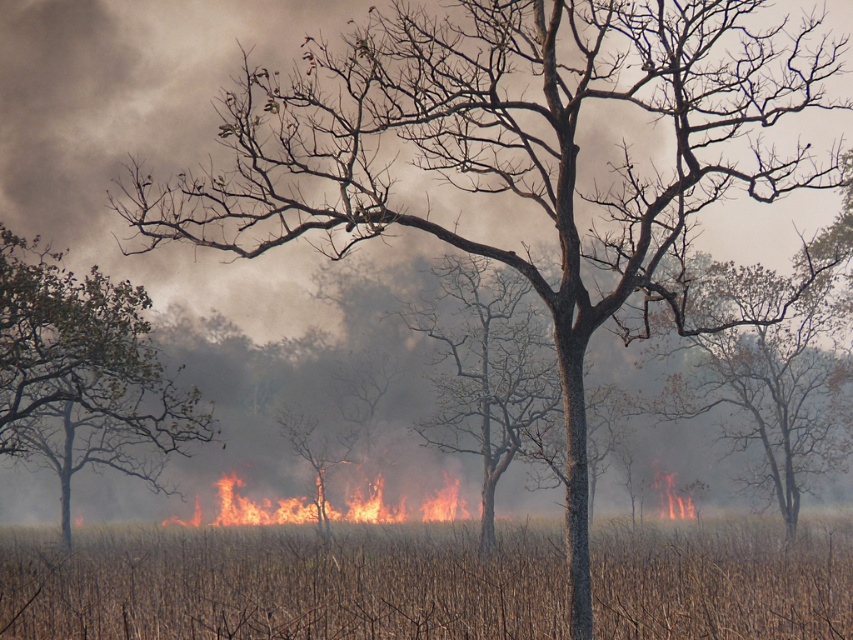
Question: Which of the following is the farthest from the observer?

Choices:
 (A) (173, 442)
 (B) (454, 516)

Answer: (B)

Question: Which is farther from the flaming grass at center?

Choices:
 (A) smooth bark tree at center
 (B) brown dry grass at center
 (C) brown leafless tree at left

Answer: (B)

Question: In this image, where is brown dry grass at center located relative to smooth bark tree at center?

Choices:
 (A) right
 (B) left

Answer: (A)

Question: Can you confirm if brown leafless tree at left is bigger than flaming grass at center?

Choices:
 (A) yes
 (B) no

Answer: (A)

Question: Among these objects, which one is farthest from the camera?

Choices:
 (A) brown dry grass at center
 (B) flaming grass at center
 (C) smooth bark tree at center

Answer: (B)

Question: Does brown dry grass at center have a smaller size compared to brown leafless tree at left?

Choices:
 (A) yes
 (B) no

Answer: (A)